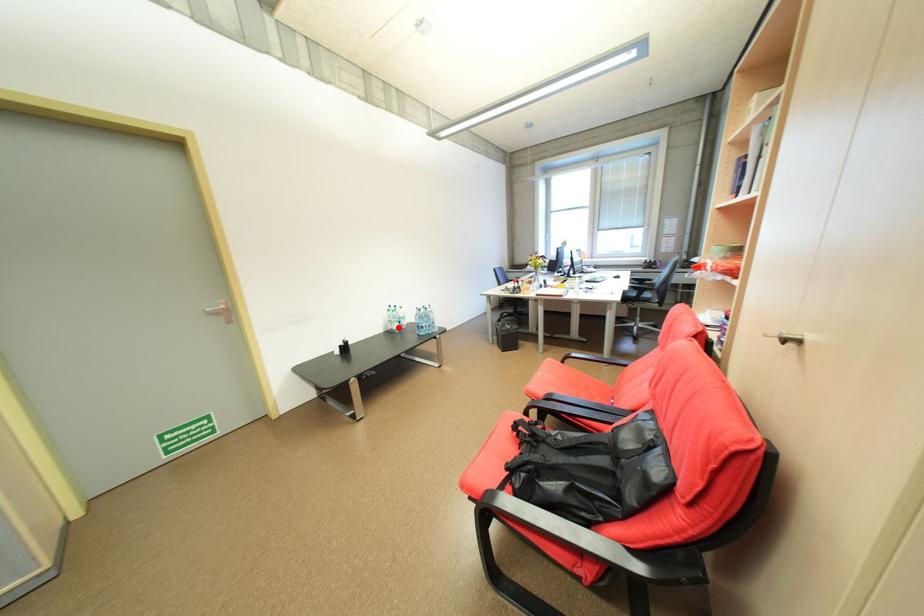
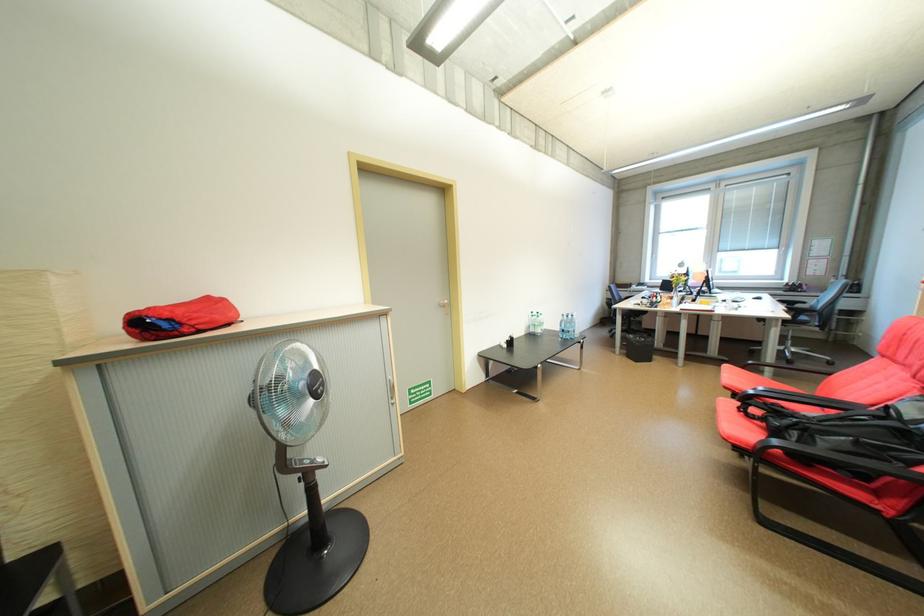
Find the pixel in the second image that matches the highlighted location in the first image.

(541, 331)